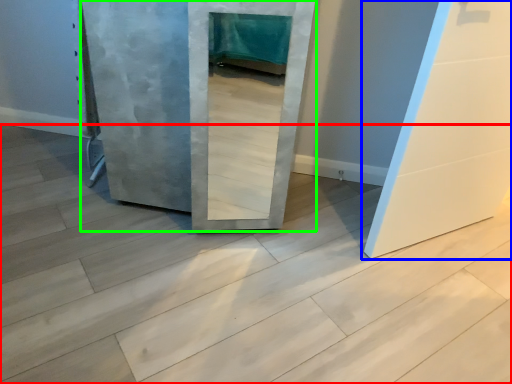
Question: Estimate the real-world distances between objects in this image. Which object is farther from concrete (highlighted by a red box), door (highlighted by a blue box) or door (highlighted by a green box)?

Choices:
 (A) door
 (B) door

Answer: (A)